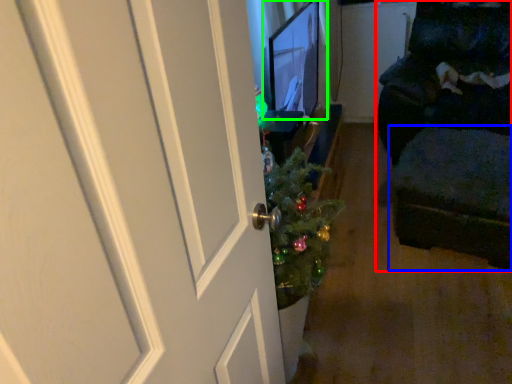
Question: Based on their relative distances, which object is nearer to furniture (highlighted by a red box)? Choose from footrest (highlighted by a blue box) and computer monitor (highlighted by a green box).

Choices:
 (A) footrest
 (B) computer monitor

Answer: (A)